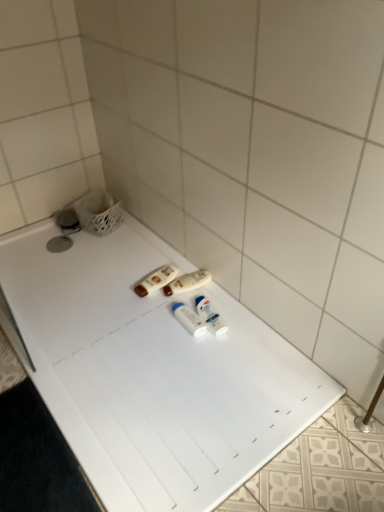
Image resolution: width=384 pixels, height=512 pixels. I want to click on free spot to the left of white plastic deodorant at center, acting as the first toiletry starting from the right, so click(x=158, y=324).